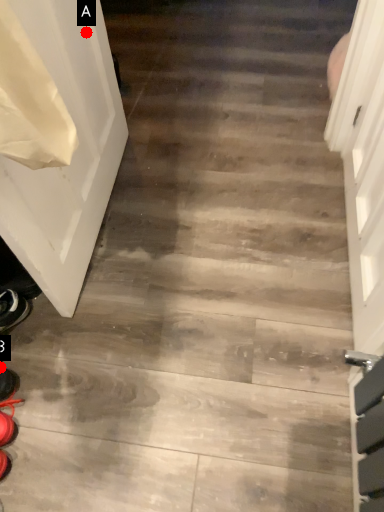
Question: Two points are circled on the image, labeled by A and B beside each circle. Which point is closer to the camera?

Choices:
 (A) A is closer
 (B) B is closer

Answer: (B)